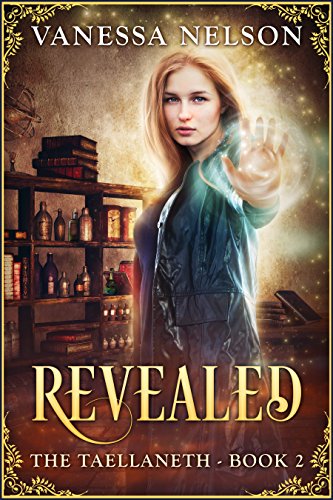
The image size is (333, 500). I want to click on bottle, so click(43, 216), click(51, 269), click(65, 286), click(78, 279), click(85, 276), click(58, 230), click(74, 235), click(85, 235).